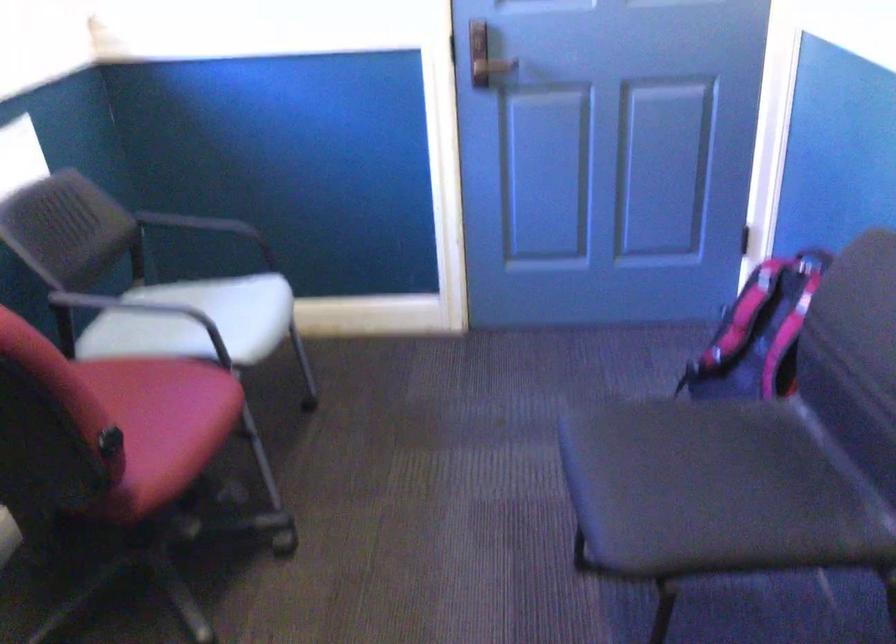
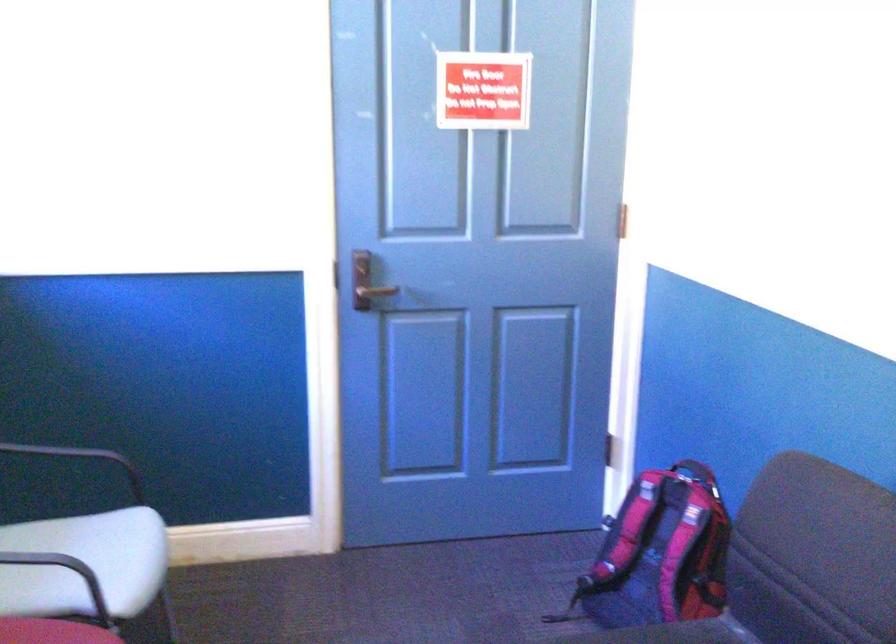
Question: Which direction would the cameraman need to move to produce the second image? Reply with the corresponding letter.

Choices:
 (A) Left
 (B) Right
 (C) Forward
 (D) Backward

Answer: (A)